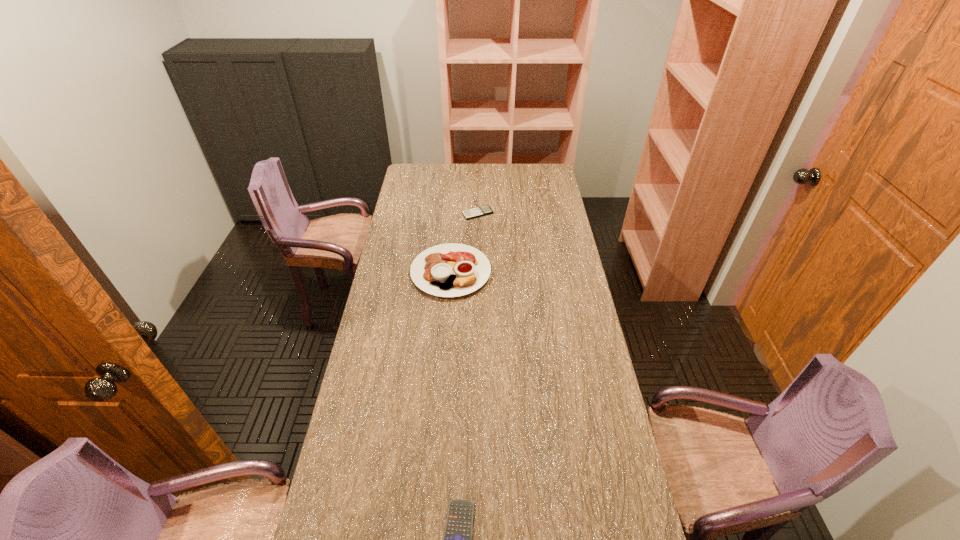
In order to click on the tallest object in this screenshot , I will do `click(451, 269)`.

The image size is (960, 540). I want to click on the second nearest object, so click(x=451, y=269).

You are a GUI agent. You are given a task and a screenshot of the screen. Output one action in this format:
    pyautogui.click(x=<x>, y=<y>)
    Task: Click on the farther calculator
    
    Given the screenshot: What is the action you would take?
    pyautogui.click(x=485, y=210)

This screenshot has height=540, width=960. I want to click on the second shortest object, so click(x=485, y=210).

This screenshot has width=960, height=540. What are the coordinates of `free point located on the front of the second farthest object` in the screenshot? It's located at (444, 372).

I want to click on free space located 0.290m on the left of the farther calculator, so click(400, 213).

This screenshot has width=960, height=540. I want to click on object at the left edge, so click(x=451, y=269).

Identify the location of free space at the far edge. (497, 174).

I want to click on vacant region at the left edge of the desktop, so click(425, 194).

Where is `vacant area at the right edge of the desktop`? vacant area at the right edge of the desktop is located at coordinates (569, 305).